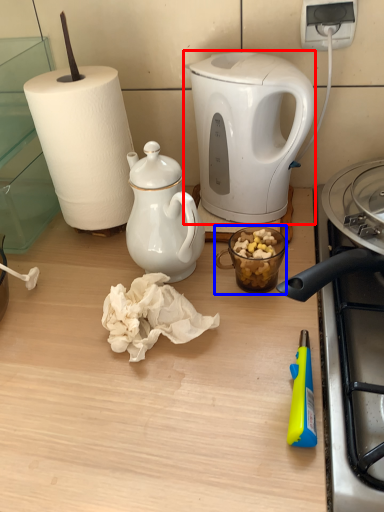
Question: Among these objects, which one is farthest to the camera, kettle (highlighted by a red box) or coffee cup (highlighted by a blue box)?

Choices:
 (A) kettle
 (B) coffee cup

Answer: (A)